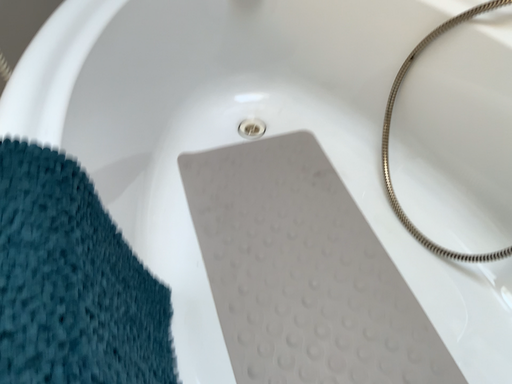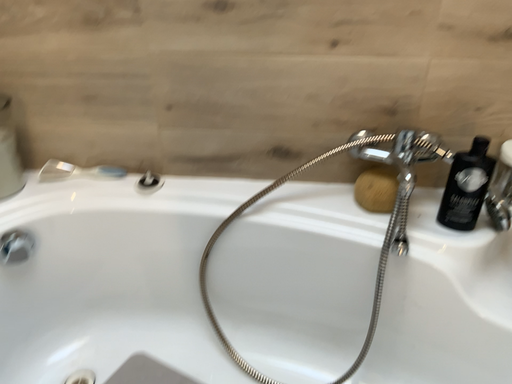
Question: How did the camera likely rotate when shooting the video?

Choices:
 (A) rotated upward
 (B) rotated downward

Answer: (A)